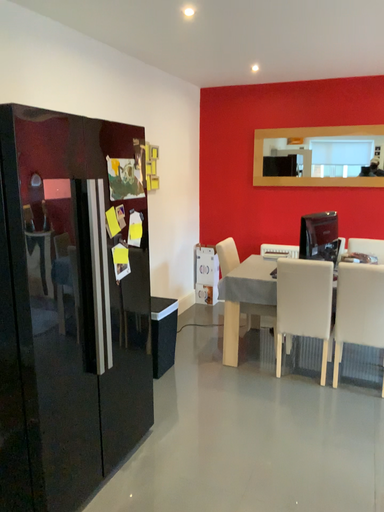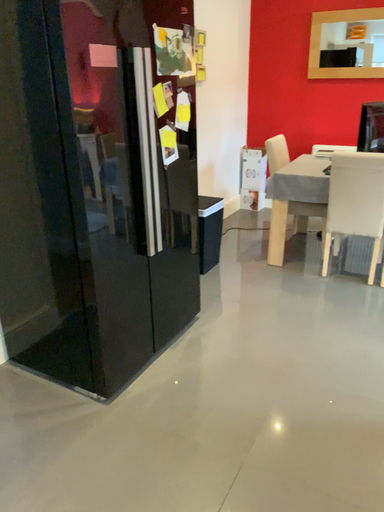
Question: Which way did the camera rotate in the video?

Choices:
 (A) rotated downward
 (B) rotated upward

Answer: (A)